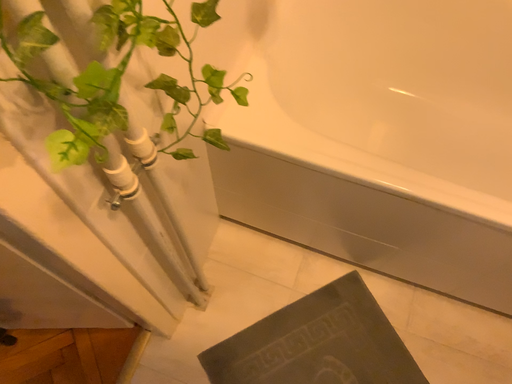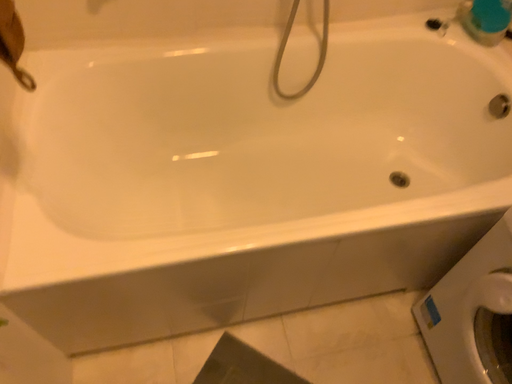
Question: How did the camera likely rotate when shooting the video?

Choices:
 (A) rotated downward
 (B) rotated upward

Answer: (B)